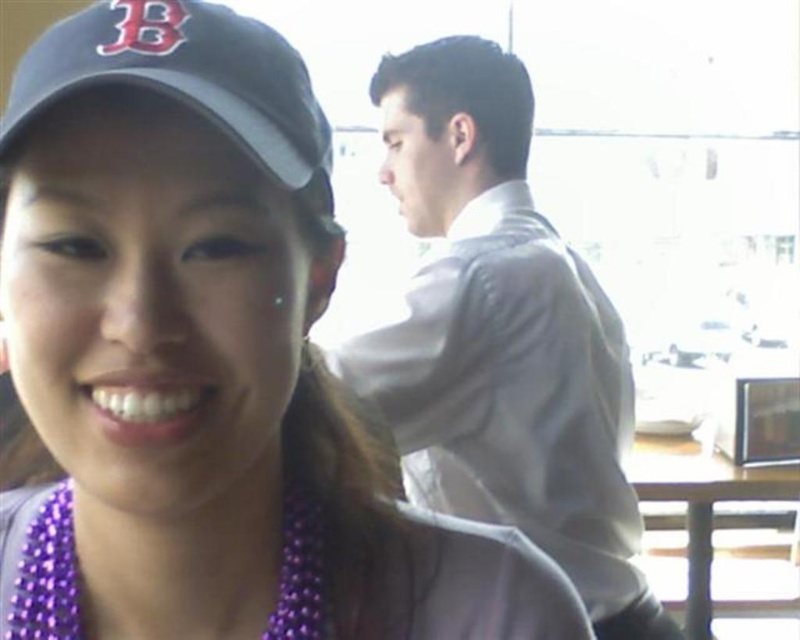
You are a photographer trying to capture a clear shot of the purple beaded necklace at center and the black fabric baseball cap at upper left. Which object is closer to the camera based on their positions in the image?

The purple beaded necklace at center is positioned under the black fabric baseball cap at upper left, meaning the necklace is closer to the camera since it is below the cap in the frame.

Based on the scene description, can you determine if the white smooth shirt at upper center is wider than the purple beaded necklace at lower left?

The white smooth shirt at upper center might be wider than purple beaded necklace at lower left according to the description.

You are a photographer trying to capture a clear shot of the purple beaded necklace at lower left without the white smooth shirt at upper center blocking it. What adjustment should you make to your camera angle?

The purple beaded necklace at lower left is behind the white smooth shirt at upper center, so to avoid blocking, you should lower your camera angle to position the necklace in front of the shirt.